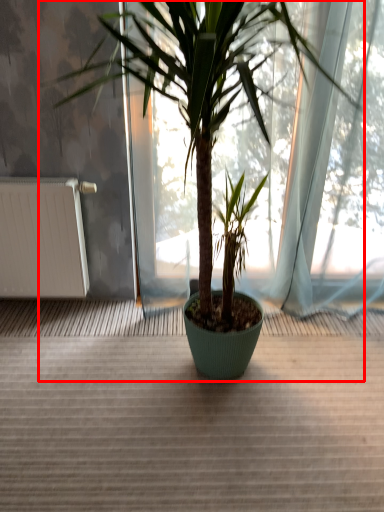
Question: Observing the image, what is the correct spatial positioning of houseplant (annotated by the red box) in reference to radiator?

Choices:
 (A) left
 (B) right

Answer: (B)